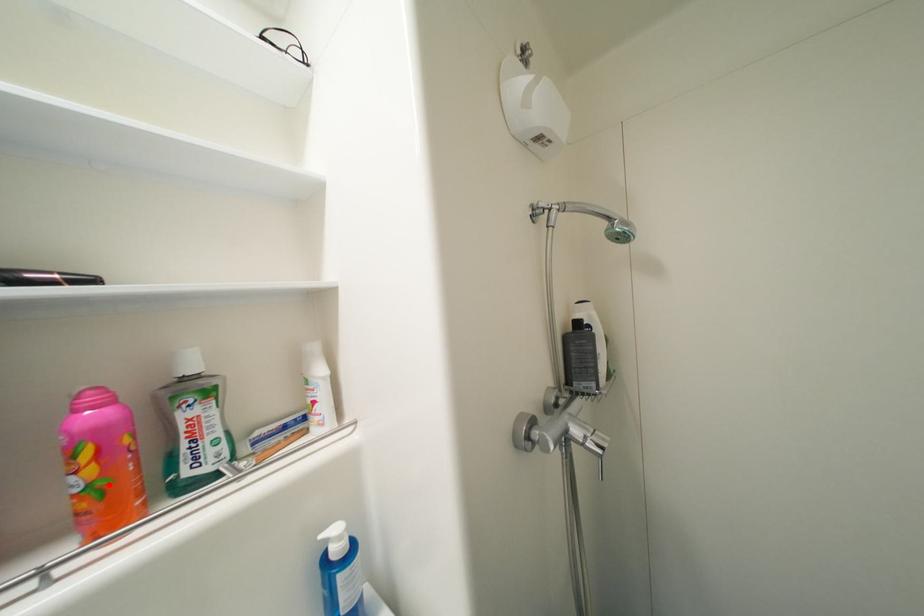
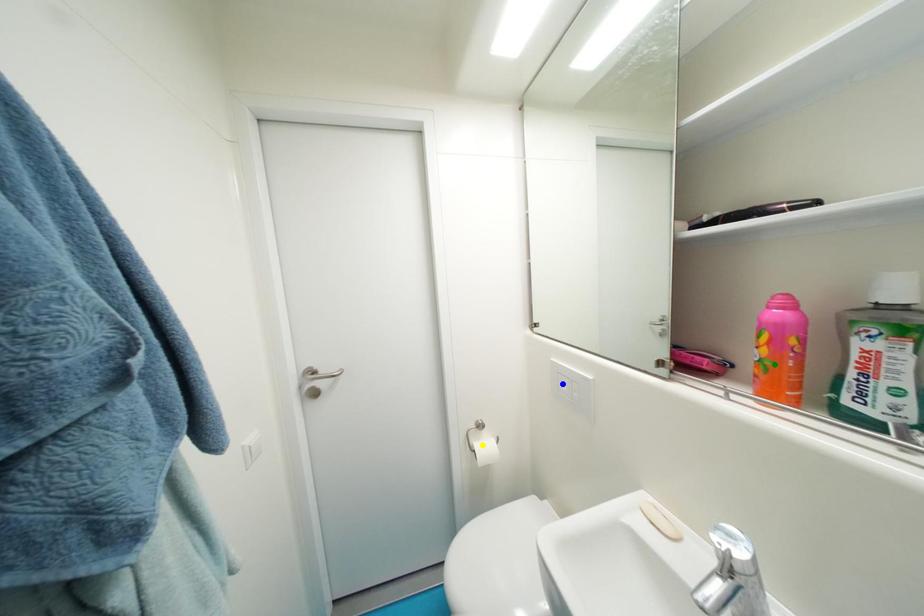
Question: I am providing you with two images of the same scene from different viewpoints. A red point is marked on the first image. You are given multiple points on the second image. Which spot in image 2 lines up with the point in image 1?

Choices:
 (A) blue point
 (B) green point
 (C) yellow point

Answer: (B)